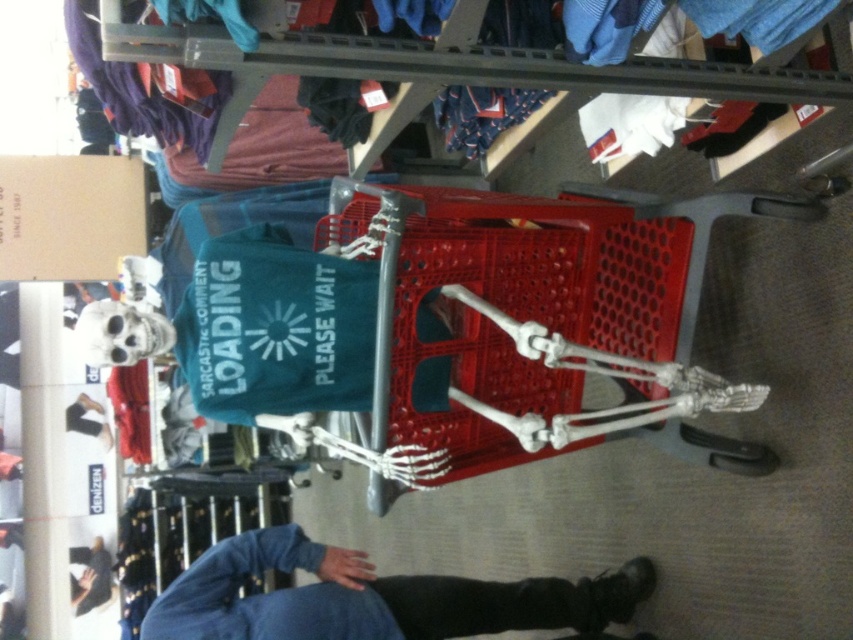
Question: Can you confirm if red plastic trolley at center is positioned above blue fabric shirt at lower center?

Choices:
 (A) yes
 (B) no

Answer: (A)

Question: Which object is positioned farthest from the black matte shoes at lower center?

Choices:
 (A) red plastic trolley at center
 (B) blue fabric shirt at lower center
 (C) blue soft sweatshirt at lower center

Answer: (A)

Question: Is the position of blue soft sweatshirt at lower center less distant than that of black matte shoes at lower center?

Choices:
 (A) yes
 (B) no

Answer: (A)

Question: Is blue soft sweatshirt at lower center positioned in front of blue fabric shirt at lower center?

Choices:
 (A) no
 (B) yes

Answer: (B)

Question: Estimate the real-world distances between objects in this image. Which object is closer to the black matte shoes at lower center?

Choices:
 (A) blue fabric shirt at lower center
 (B) blue soft sweatshirt at lower center
 (C) red plastic trolley at center

Answer: (A)

Question: Which point is farther to the camera?

Choices:
 (A) (109, 572)
 (B) (595, 632)

Answer: (A)